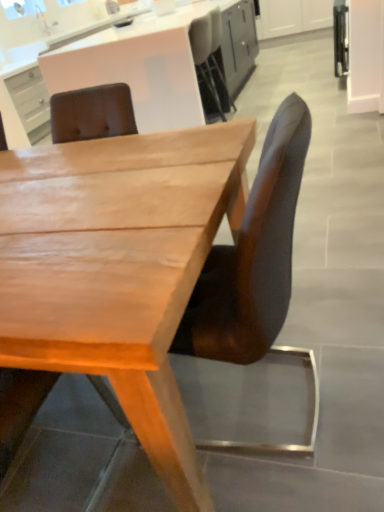
What do you see at coordinates (255, 271) in the screenshot?
I see `brown leather chair at center, the 2th chair when ordered from left to right` at bounding box center [255, 271].

This screenshot has height=512, width=384. What do you see at coordinates (118, 268) in the screenshot?
I see `light brown wood desk at center` at bounding box center [118, 268].

At what (x,y) coordinates should I click in order to perform the action: click on matte white cabinet at upper center. Please return your answer as a coordinate pair (x, y). This screenshot has width=384, height=512. Looking at the image, I should click on (130, 69).

Is silver metallic faucet at upper left with light brown wood desk at center?

They are not placed beside each other.

Considering the sizes of objects silver metallic faucet at upper left and light brown wood desk at center in the image provided, who is smaller, silver metallic faucet at upper left or light brown wood desk at center?

silver metallic faucet at upper left.

Is point (39, 9) closer or farther from the camera than point (165, 432)?

Clearly, point (39, 9) is more distant from the camera than point (165, 432).

Considering the relative sizes of wooden chair at center, the 1th chair viewed from the left, and silver metallic faucet at upper left in the image provided, is wooden chair at center, the 1th chair viewed from the left, smaller than silver metallic faucet at upper left?

Actually, wooden chair at center, the 1th chair viewed from the left, might be larger than silver metallic faucet at upper left.

Which object is further away from the camera, wooden chair at center, acting as the 2th chair starting from the right, or silver metallic faucet at upper left?

silver metallic faucet at upper left is behind.

Is wooden chair at center, the 1th chair viewed from the left, taller than silver metallic faucet at upper left?

Indeed, wooden chair at center, the 1th chair viewed from the left, has a greater height compared to silver metallic faucet at upper left.

From a real-world perspective, is wooden chair at center, acting as the 2th chair starting from the right, positioned above or below silver metallic faucet at upper left?

In terms of real-world spatial position, wooden chair at center, acting as the 2th chair starting from the right, is below silver metallic faucet at upper left.

From the image's perspective, is brown leather chair at center, the 2th chair when ordered from left to right, over wooden chair at center, the 1th chair viewed from the left?

Yes, from the image's perspective, brown leather chair at center, the 2th chair when ordered from left to right, is over wooden chair at center, the 1th chair viewed from the left.

Considering the points (204, 316) and (7, 429), which point is behind, point (204, 316) or point (7, 429)?

Point (204, 316)

Who is taller, brown leather chair at center, the 2th chair when ordered from left to right, or wooden chair at center, the 1th chair viewed from the left?

Standing taller between the two is wooden chair at center, the 1th chair viewed from the left.

Is brown leather chair at center, the 2th chair when ordered from left to right, in contact with wooden chair at center, acting as the 2th chair starting from the right?

No.

Can you tell me how much wooden chair at center, the 1th chair viewed from the left, and brown leather chair at center, the 2th chair when ordered from left to right, differ in facing direction?

89 degrees separate the facing orientations of wooden chair at center, the 1th chair viewed from the left, and brown leather chair at center, the 2th chair when ordered from left to right.

Considering the sizes of objects wooden chair at center, acting as the 2th chair starting from the right, and brown leather chair at center, the 2th chair when ordered from left to right, in the image provided, who is thinner, wooden chair at center, acting as the 2th chair starting from the right, or brown leather chair at center, the 2th chair when ordered from left to right,?

wooden chair at center, acting as the 2th chair starting from the right.

From the image's perspective, which is above, wooden chair at center, acting as the 2th chair starting from the right, or brown leather chair at center, the 2th chair when ordered from left to right?

From the image's view, brown leather chair at center, the 2th chair when ordered from left to right, is above.

Is wooden chair at center, acting as the 2th chair starting from the right, with brown leather chair at center, arranged as the first chair when viewed from the right?

wooden chair at center, acting as the 2th chair starting from the right, and brown leather chair at center, arranged as the first chair when viewed from the right, are clearly separated.

Can you confirm if matte white cabinet at upper center is taller than light brown wood desk at center?

Indeed, matte white cabinet at upper center has a greater height compared to light brown wood desk at center.

Based on the photo, from a real-world perspective, which is physically above, matte white cabinet at upper center or light brown wood desk at center?

From a 3D spatial view, matte white cabinet at upper center is above.

Is the position of matte white cabinet at upper center less distant than that of light brown wood desk at center?

That is False.

Consider the image. From a real-world perspective, does light brown wood desk at center sit lower than matte white cabinet at upper center?

Correct, in the physical world, light brown wood desk at center is lower than matte white cabinet at upper center.

Is light brown wood desk at center facing towards matte white cabinet at upper center?

No, light brown wood desk at center is not oriented towards matte white cabinet at upper center.

From the picture: What's the angular difference between light brown wood desk at center and matte white cabinet at upper center's facing directions?

The angle between the facing direction of light brown wood desk at center and the facing direction of matte white cabinet at upper center is 90 degrees.

Which object is positioned more to the right, light brown wood desk at center or matte white cabinet at upper center?

matte white cabinet at upper center is more to the right.

Could you tell me if brown leather chair at center, the 2th chair when ordered from left to right, is turned towards silver metallic faucet at upper left?

No, brown leather chair at center, the 2th chair when ordered from left to right, is not facing towards silver metallic faucet at upper left.

What's the angular difference between brown leather chair at center, the 2th chair when ordered from left to right, and silver metallic faucet at upper left's facing directions?

The facing directions of brown leather chair at center, the 2th chair when ordered from left to right, and silver metallic faucet at upper left are 177 degrees apart.

Which is behind, brown leather chair at center, the 2th chair when ordered from left to right, or silver metallic faucet at upper left?

silver metallic faucet at upper left is further away from the camera.

From a real-world perspective, which object stands above the other?

silver metallic faucet at upper left.

I want to click on faucet behind the light brown wood desk at center, so click(x=43, y=20).

Where is `the 1st chair to the right of the silver metallic faucet at upper left, counting from the anchor's position`? Image resolution: width=384 pixels, height=512 pixels. the 1st chair to the right of the silver metallic faucet at upper left, counting from the anchor's position is located at coordinates (92, 113).

Which object lies further to the anchor point light brown wood desk at center, matte white cabinet at upper center or wooden chair at center, acting as the 2th chair starting from the right?

matte white cabinet at upper center.

Based on their spatial positions, is brown leather chair at center, arranged as the first chair when viewed from the right, or wooden chair at center, the 1th chair viewed from the left, closer to matte white cabinet at upper center?

Among the two, wooden chair at center, the 1th chair viewed from the left, is located nearer to matte white cabinet at upper center.

Which object lies further to the anchor point wooden chair at center, the 1th chair viewed from the left, light brown wood desk at center or matte white cabinet at upper center?

matte white cabinet at upper center is positioned further to the anchor wooden chair at center, the 1th chair viewed from the left.

Looking at the image, which one is located closer to silver metallic faucet at upper left, light brown wood desk at center or matte white cabinet at upper center?

matte white cabinet at upper center.

From the image, which object appears to be farther from brown leather chair at center, the 2th chair when ordered from left to right, wooden chair at center, the 1th chair viewed from the left, or matte white cabinet at upper center?

matte white cabinet at upper center lies further to brown leather chair at center, the 2th chair when ordered from left to right, than the other object.

When comparing their distances from matte white cabinet at upper center, does light brown wood desk at center or silver metallic faucet at upper left seem closer?

Among the two, silver metallic faucet at upper left is located nearer to matte white cabinet at upper center.

Based on their spatial positions, is wooden chair at center, acting as the 2th chair starting from the right, or silver metallic faucet at upper left closer to matte white cabinet at upper center?

silver metallic faucet at upper left lies closer to matte white cabinet at upper center than the other object.

From the image, which object appears to be nearer to matte white cabinet at upper center, wooden chair at center, acting as the 2th chair starting from the right, or light brown wood desk at center?

light brown wood desk at center.

Image resolution: width=384 pixels, height=512 pixels. I want to click on chair between light brown wood desk at center and matte white cabinet at upper center in the front-back direction, so click(x=255, y=271).

Locate an element on the screen. The image size is (384, 512). desk between wooden chair at center, acting as the 2th chair starting from the right, and brown leather chair at center, arranged as the first chair when viewed from the right, in the horizontal direction is located at coordinates (118, 268).

The height and width of the screenshot is (512, 384). What are the coordinates of `chair between wooden chair at center, acting as the 2th chair starting from the right, and silver metallic faucet at upper left in the front-back direction` in the screenshot? It's located at (255, 271).

Where is `cabinetry positioned between wooden chair at center, acting as the 2th chair starting from the right, and silver metallic faucet at upper left from near to far`? cabinetry positioned between wooden chair at center, acting as the 2th chair starting from the right, and silver metallic faucet at upper left from near to far is located at coordinates (130, 69).